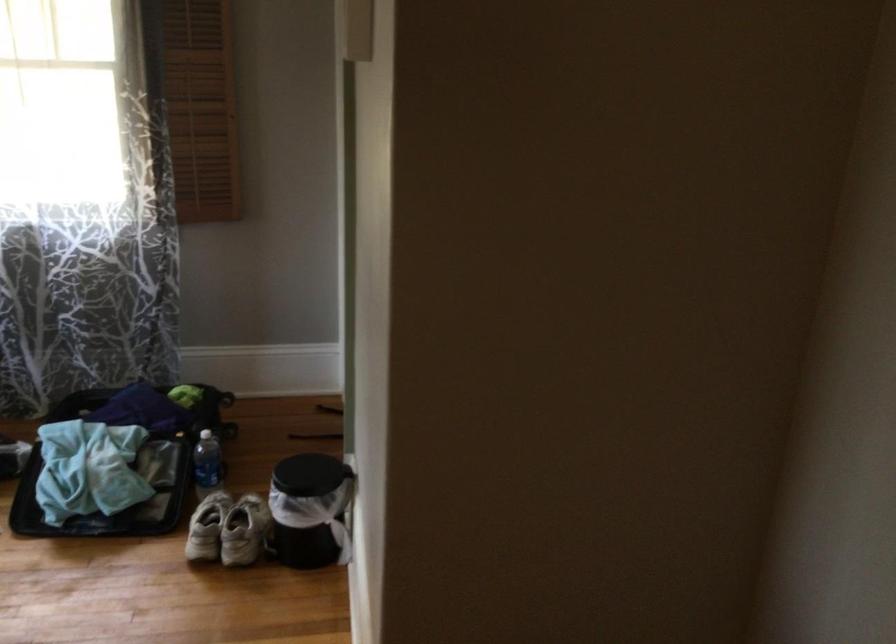
Find where to lift the open black suitcase. Please return your answer as a coordinate pair (x, y).

(110, 491)